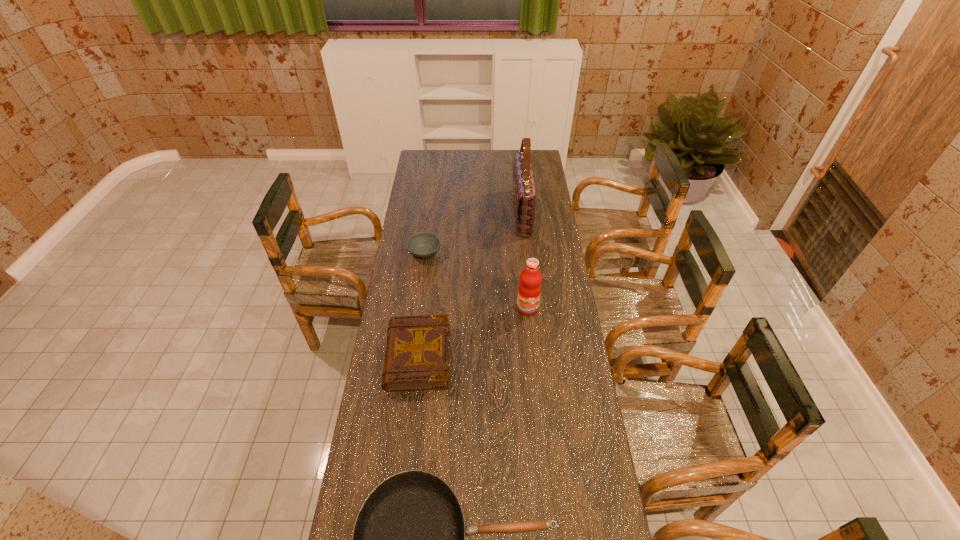
The height and width of the screenshot is (540, 960). I want to click on the tallest object, so click(524, 193).

I want to click on handbag, so click(524, 193).

Locate an element on the screen. fruit juice is located at coordinates (529, 290).

At what (x,y) coordinates should I click in order to perform the action: click on the second tallest object. Please return your answer as a coordinate pair (x, y). The height and width of the screenshot is (540, 960). Looking at the image, I should click on tap(529, 290).

The width and height of the screenshot is (960, 540). In order to click on hardback book in this screenshot , I will do `click(417, 351)`.

You are a GUI agent. You are given a task and a screenshot of the screen. Output one action in this format:
    pyautogui.click(x=<x>, y=<y>)
    Task: Click on the second nearest object
    The width and height of the screenshot is (960, 540).
    Given the screenshot: What is the action you would take?
    pyautogui.click(x=417, y=351)

Locate an element on the screen. the fourth nearest object is located at coordinates (423, 245).

At what (x,y) coordinates should I click in order to perform the action: click on free region located on the front of the tallest object with the clasp. Please return your answer as a coordinate pair (x, y). The width and height of the screenshot is (960, 540). Looking at the image, I should click on (453, 213).

Find the location of `free space located 0.140m on the front of the tallest object with the clasp`. free space located 0.140m on the front of the tallest object with the clasp is located at coordinates click(x=485, y=213).

What are the coordinates of `blank area located 0.120m on the front of the tallest object with the clasp` in the screenshot? It's located at (489, 213).